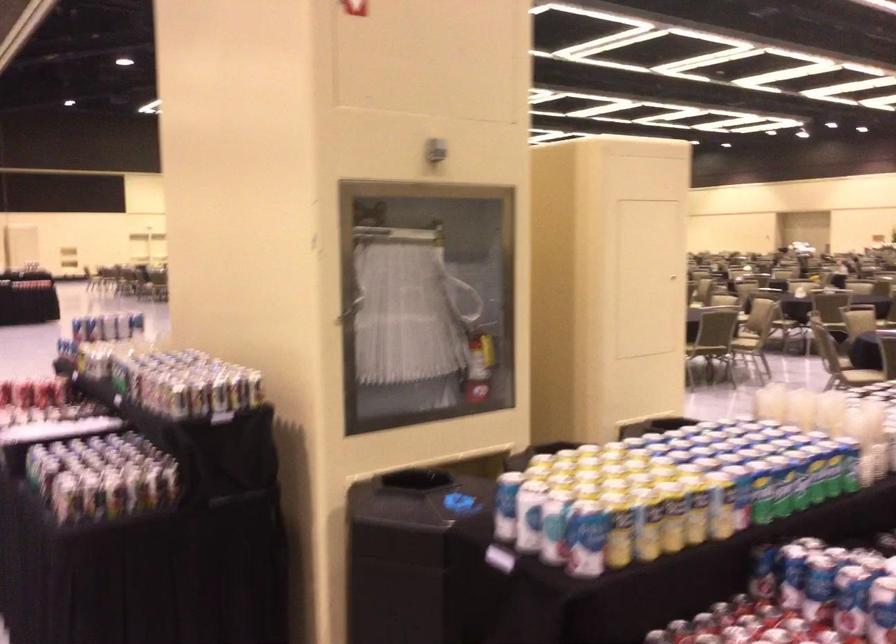
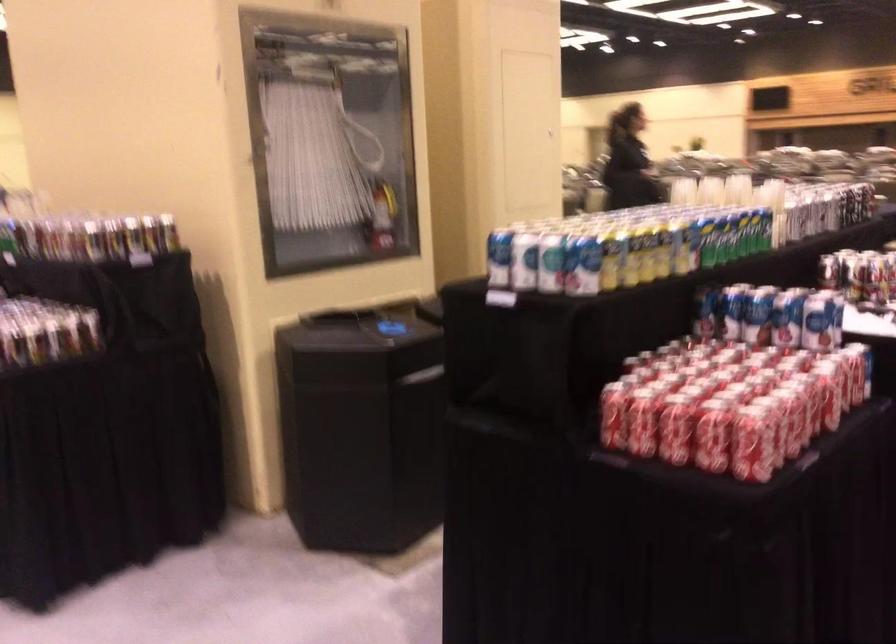
Where in the second image is the point corresponding to pixel 214 406 from the first image?

(131, 254)